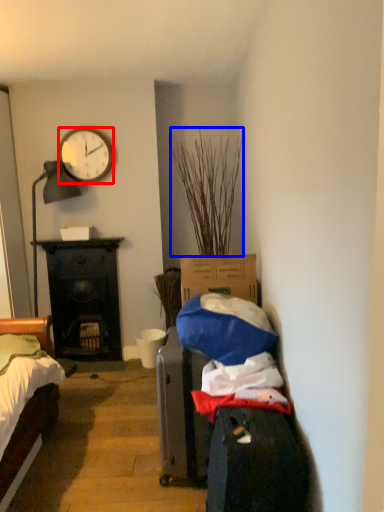
Question: Among these objects, which one is farthest to the camera, clock (highlighted by a red box) or plant (highlighted by a blue box)?

Choices:
 (A) clock
 (B) plant

Answer: (A)